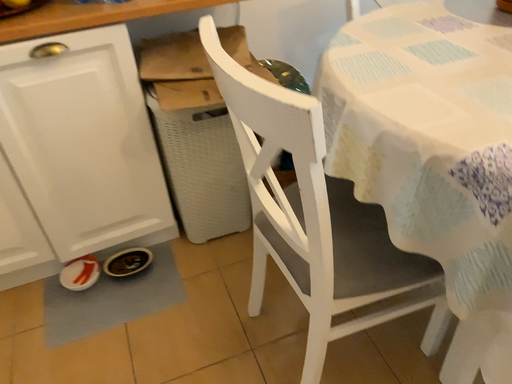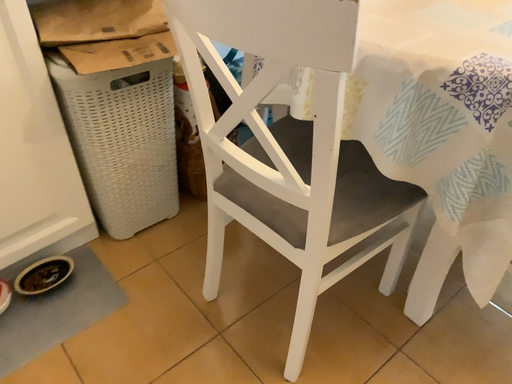
Question: Which way did the camera rotate in the video?

Choices:
 (A) rotated right
 (B) rotated left

Answer: (A)